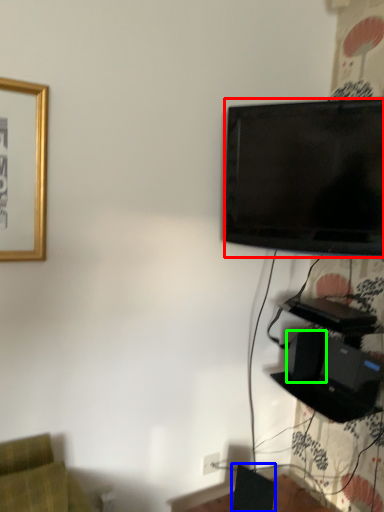
Question: Which is farther away from television (highlighted by a red box)? speaker (highlighted by a blue box) or speaker (highlighted by a green box)?

Choices:
 (A) speaker
 (B) speaker

Answer: (A)